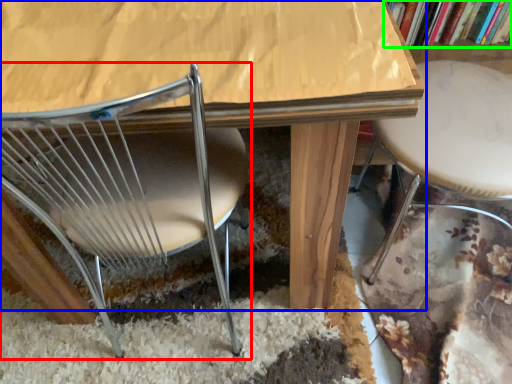
Question: Which is farther away from chair (highlighted by a red box)? table (highlighted by a blue box) or book (highlighted by a green box)?

Choices:
 (A) table
 (B) book

Answer: (B)